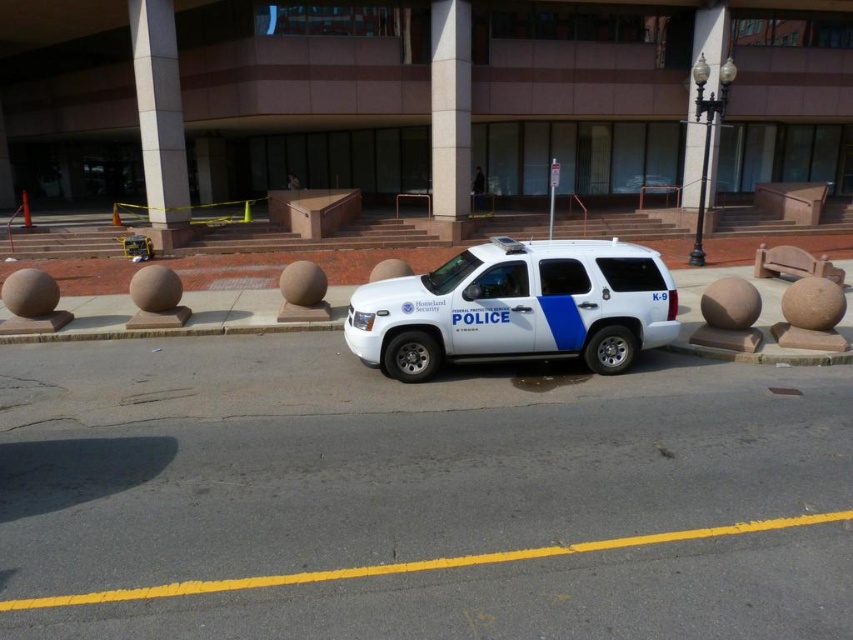
Is point (433, 273) positioned behind point (675, 186)?

No, it is in front of (675, 186).

Between white matte/police van at center and white matte police suv at center, which one appears on the right side from the viewer's perspective?

Positioned to the right is white matte police suv at center.

You are a GUI agent. You are given a task and a screenshot of the screen. Output one action in this format:
    pyautogui.click(x=<x>, y=<y>)
    Task: Click on the white matte/police van at center
    This screenshot has height=640, width=853.
    Given the screenshot: What is the action you would take?
    pyautogui.click(x=517, y=307)